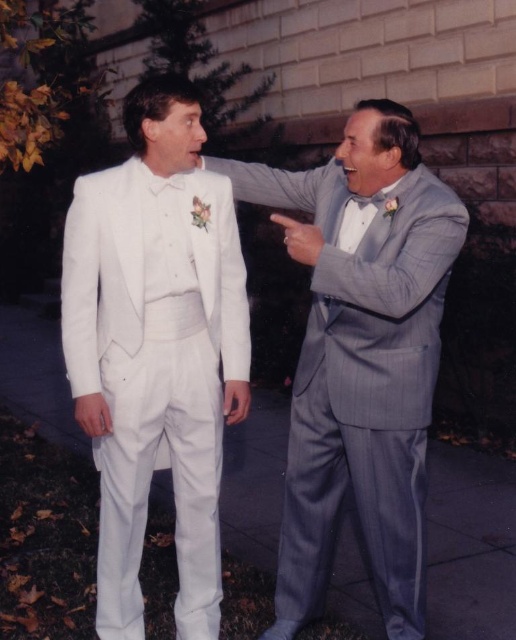
You are standing at the center of the image and want to know how far the point at coordinates (378,330) is from you. Can you determine the distance?

The point at coordinates (378,330) is 7.86 feet from the viewer.

You are a photographer at a formal event. You need to position two guests for a group photo. The guests are wearing the white satin tuxedo at center and the gray pinstripe suit at right. To ensure both are visible in the photo, which guest should stand closer to the camera to avoid being blocked by the other?

The gray pinstripe suit at right should stand closer to the camera because the white satin tuxedo at center is much taller, so positioning the shorter guest closer will prevent the taller one from blocking them.